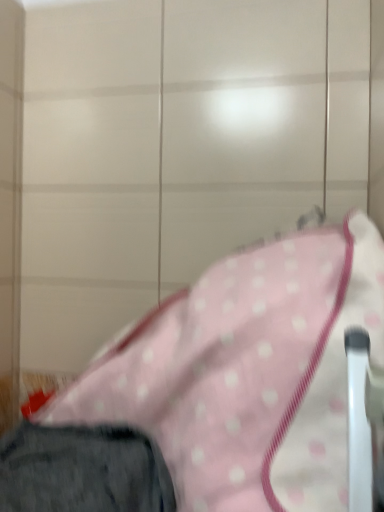
Question: From a real-world perspective, is dark gray fabric trousers at lower left above or below pink polka dot fabric at center?

Choices:
 (A) above
 (B) below

Answer: (B)

Question: From the image's perspective, is dark gray fabric trousers at lower left positioned above or below pink polka dot fabric at center?

Choices:
 (A) above
 (B) below

Answer: (B)

Question: Looking at the image, does dark gray fabric trousers at lower left seem bigger or smaller compared to pink polka dot fabric at center?

Choices:
 (A) big
 (B) small

Answer: (B)

Question: From a real-world perspective, is pink polka dot fabric at center above or below dark gray fabric trousers at lower left?

Choices:
 (A) below
 (B) above

Answer: (B)

Question: Does point (61, 394) appear closer or farther from the camera than point (52, 431)?

Choices:
 (A) closer
 (B) farther

Answer: (B)

Question: Is pink polka dot fabric at center situated inside dark gray fabric trousers at lower left or outside?

Choices:
 (A) outside
 (B) inside

Answer: (A)

Question: Relative to dark gray fabric trousers at lower left, is pink polka dot fabric at center in front or behind?

Choices:
 (A) behind
 (B) front

Answer: (A)